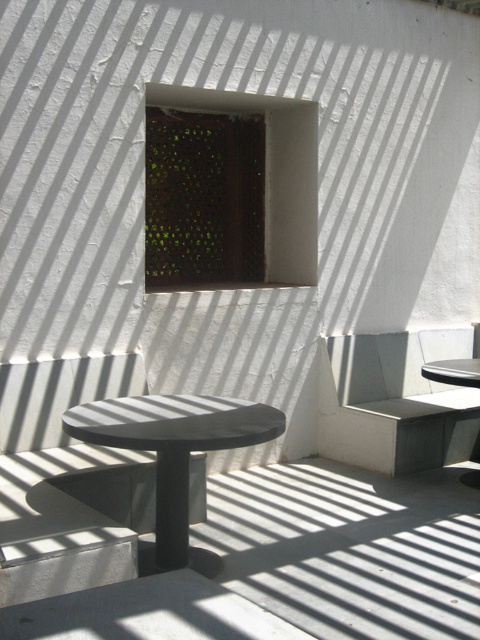
Question: Which point is farther from the camera taking this photo?

Choices:
 (A) (342, 461)
 (B) (447, 372)
 (C) (276, 134)
 (D) (177, 444)

Answer: (C)

Question: Can you confirm if matte gray table at center is positioned above smooth gray table at right?

Choices:
 (A) yes
 (B) no

Answer: (B)

Question: Does matte gray table at center have a lesser width compared to green mesh screen at upper center?

Choices:
 (A) no
 (B) yes

Answer: (B)

Question: Among these objects, which one is farthest from the camera?

Choices:
 (A) green mesh screen at upper center
 (B) smooth gray table at right
 (C) matte gray table at center

Answer: (A)

Question: Which point is closer to the camera?

Choices:
 (A) smooth gray table at right
 (B) matte gray table at center
 (C) concrete bench at right
 (D) green mesh screen at upper center

Answer: (B)

Question: Is concrete bench at right thinner than green mesh screen at upper center?

Choices:
 (A) yes
 (B) no

Answer: (B)